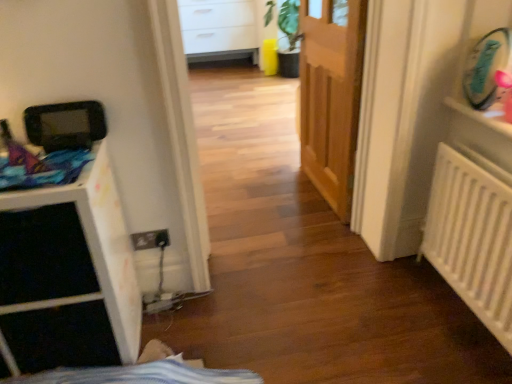
The width and height of the screenshot is (512, 384). Identify the location of vacant space in front of wooden door at center. (298, 216).